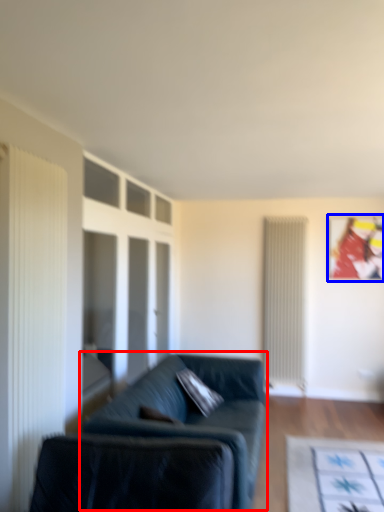
Question: Which point is further to the camera, studio couch (highlighted by a red box) or picture frame (highlighted by a blue box)?

Choices:
 (A) studio couch
 (B) picture frame

Answer: (B)